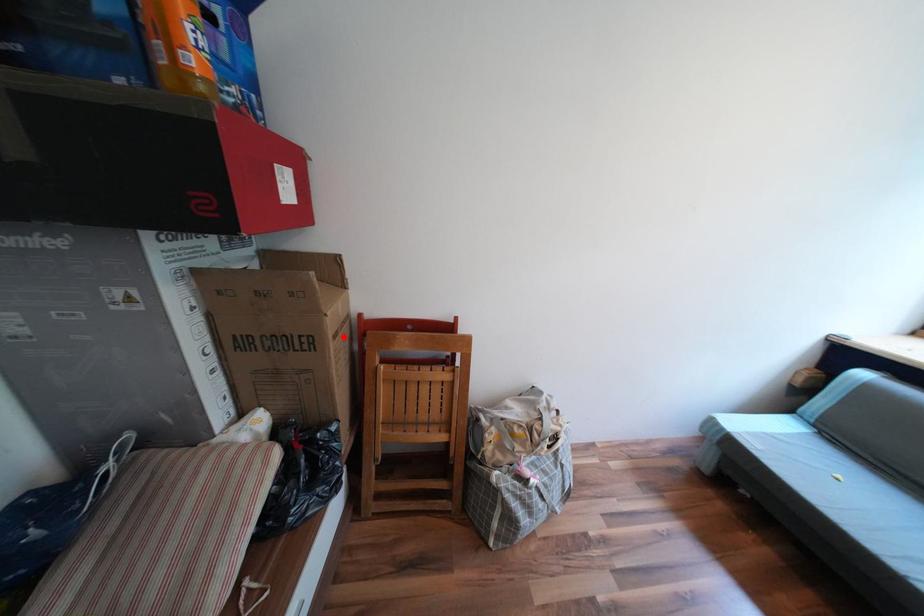
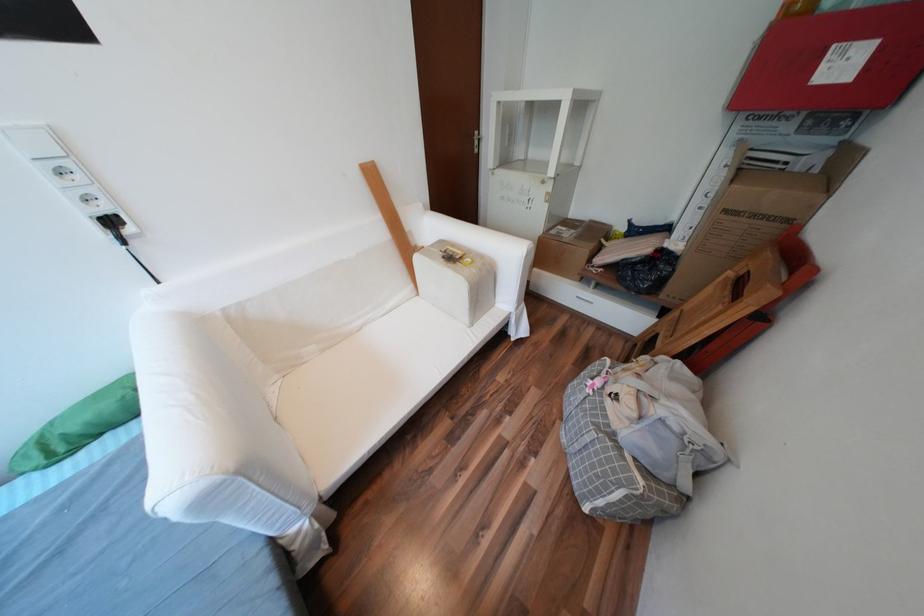
Question: I am providing you with two images of the same scene from different viewpoints. A red point is shown in image1. For the corresponding object point in image2, is it positioned nearer or farther from the camera?

Choices:
 (A) Nearer
 (B) Farther

Answer: (B)